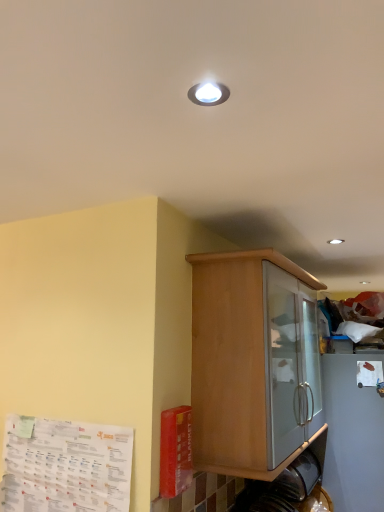
Question: From the image's perspective, would you say white matte paper at upper right, the 1th paper when ordered from back to front, is positioned over wooden cabinet at center?

Choices:
 (A) no
 (B) yes

Answer: (A)

Question: Considering the relative positions of white matte paper at upper right, the 1th paper when ordered from back to front, and wooden cabinet at center in the image provided, is white matte paper at upper right, the 1th paper when ordered from back to front, behind wooden cabinet at center?

Choices:
 (A) yes
 (B) no

Answer: (A)

Question: Does white matte paper at upper right, the 1th paper when ordered from back to front, appear on the right side of wooden cabinet at center?

Choices:
 (A) no
 (B) yes

Answer: (B)

Question: Can you confirm if white matte paper at upper right, arranged as the first paper when viewed from the right, is shorter than wooden cabinet at center?

Choices:
 (A) no
 (B) yes

Answer: (B)

Question: Is white matte paper at upper right, arranged as the first paper when viewed from the right, positioned before wooden cabinet at center?

Choices:
 (A) no
 (B) yes

Answer: (A)

Question: From the image's perspective, relative to white paper at lower left, which appears as the 2th paper when viewed from the back, is white matte paper at upper right, the 1th paper when ordered from back to front, above or below?

Choices:
 (A) above
 (B) below

Answer: (A)

Question: Looking at their shapes, would you say white matte paper at upper right, the second paper viewed from the left, is wider or thinner than white paper at lower left, marked as the 1th paper in a front-to-back arrangement?

Choices:
 (A) wide
 (B) thin

Answer: (A)

Question: Is white matte paper at upper right, the 1th paper when ordered from back to front, bigger or smaller than white paper at lower left, marked as the 1th paper in a front-to-back arrangement?

Choices:
 (A) small
 (B) big

Answer: (A)

Question: In the image, is white matte paper at upper right, which ranks as the second paper in front-to-back order, on the left side or the right side of white paper at lower left, which is the second paper in right-to-left order?

Choices:
 (A) left
 (B) right

Answer: (B)

Question: Considering their positions, is wooden cabinet at center located in front of or behind white paper at lower left, arranged as the 1th paper when viewed from the left?

Choices:
 (A) front
 (B) behind

Answer: (B)

Question: From a real-world perspective, relative to white paper at lower left, which appears as the 2th paper when viewed from the back, is wooden cabinet at center vertically above or below?

Choices:
 (A) below
 (B) above

Answer: (B)

Question: From their relative heights in the image, would you say wooden cabinet at center is taller or shorter than white paper at lower left, arranged as the 1th paper when viewed from the left?

Choices:
 (A) short
 (B) tall

Answer: (B)

Question: Based on their positions, is wooden cabinet at center located to the left or right of white paper at lower left, which is the second paper in right-to-left order?

Choices:
 (A) right
 (B) left

Answer: (A)

Question: Which is correct: white paper at lower left, which appears as the 2th paper when viewed from the back, is inside white matte paper at upper right, which ranks as the second paper in front-to-back order, or outside of it?

Choices:
 (A) outside
 (B) inside

Answer: (A)

Question: In terms of width, does white paper at lower left, marked as the 1th paper in a front-to-back arrangement, look wider or thinner when compared to white matte paper at upper right, arranged as the first paper when viewed from the right?

Choices:
 (A) wide
 (B) thin

Answer: (B)